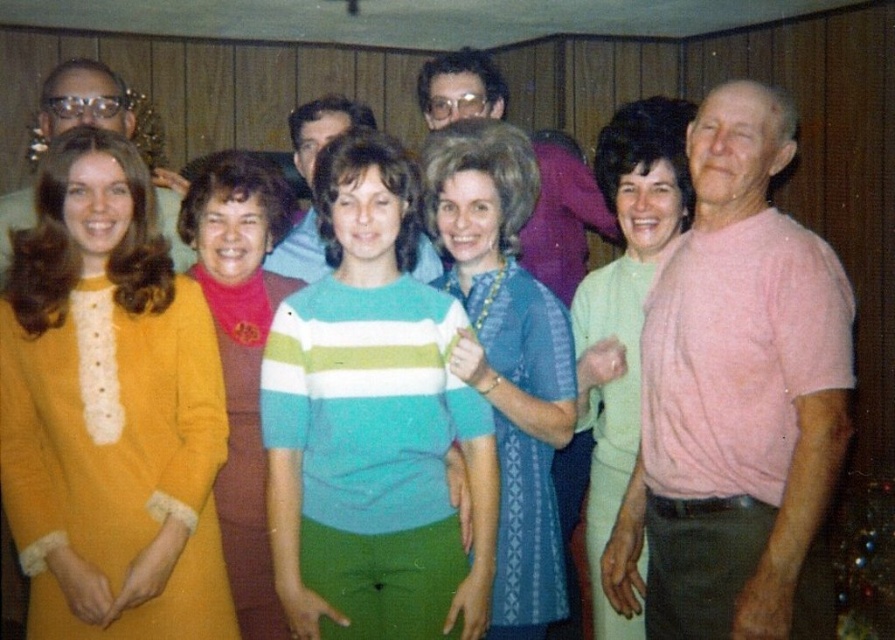
Does matte orange dress at center have a greater height compared to matte blue shirt at center?

Indeed, matte orange dress at center has a greater height compared to matte blue shirt at center.

Who is more distant from viewer, (267,630) or (314,132)?

Point (314,132)

Identify the location of matte orange dress at center. (241, 355).

Is matte orange dress at center bigger than matte pink shirt at center?

No.

Where is `matte orange dress at center`? matte orange dress at center is located at coordinates (241, 355).

Does blue textured dress at center come in front of matte orange dress at center?

That is True.

Who is more distant from viewer, (544, 420) or (239, 228)?

The point (239, 228) is behind.

Locate an element on the screen. The height and width of the screenshot is (640, 895). blue textured dress at center is located at coordinates (506, 355).